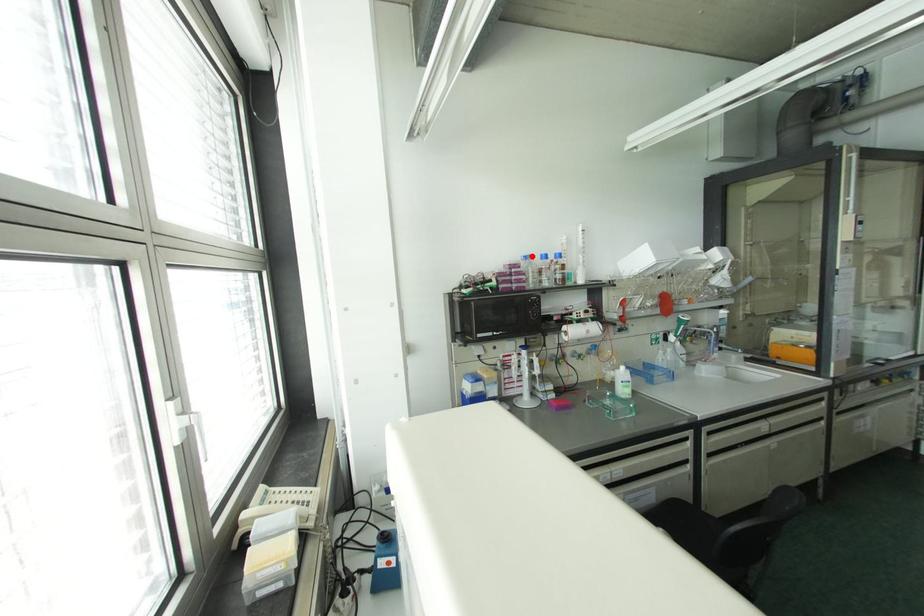
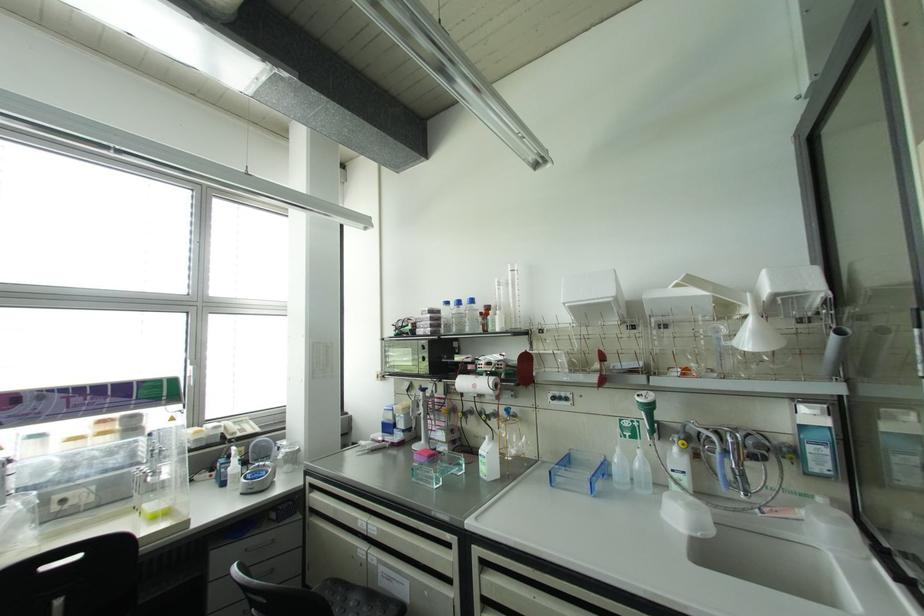
In the second image, find the point that corresponds to the highlighted location in the first image.

(446, 302)